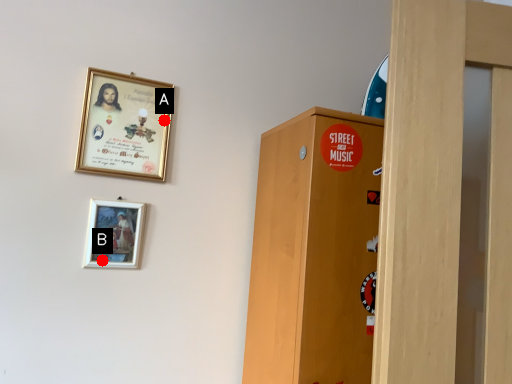
Question: Two points are circled on the image, labeled by A and B beside each circle. Which point is closer to the camera?

Choices:
 (A) A is closer
 (B) B is closer

Answer: (B)